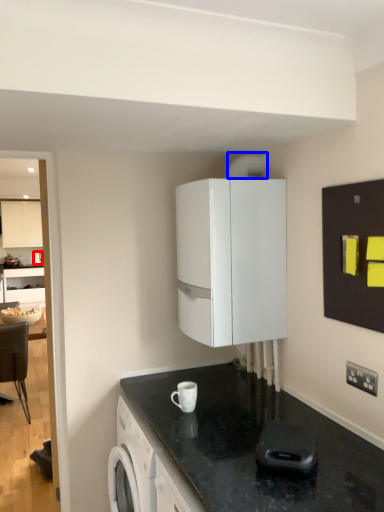
Question: Which of the following is the farthest to the observer, kitchen appliance (highlighted by a red box) or appliance (highlighted by a blue box)?

Choices:
 (A) kitchen appliance
 (B) appliance

Answer: (A)